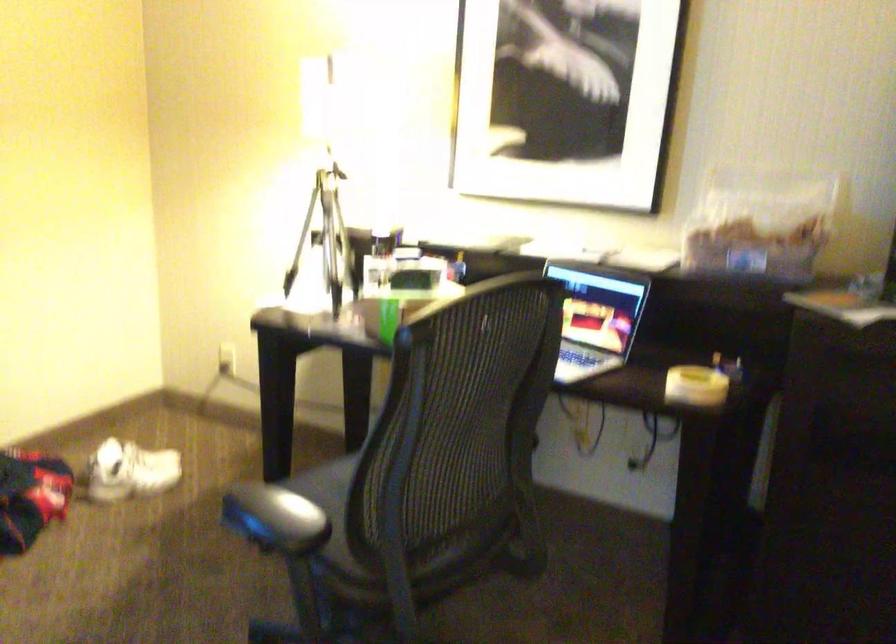
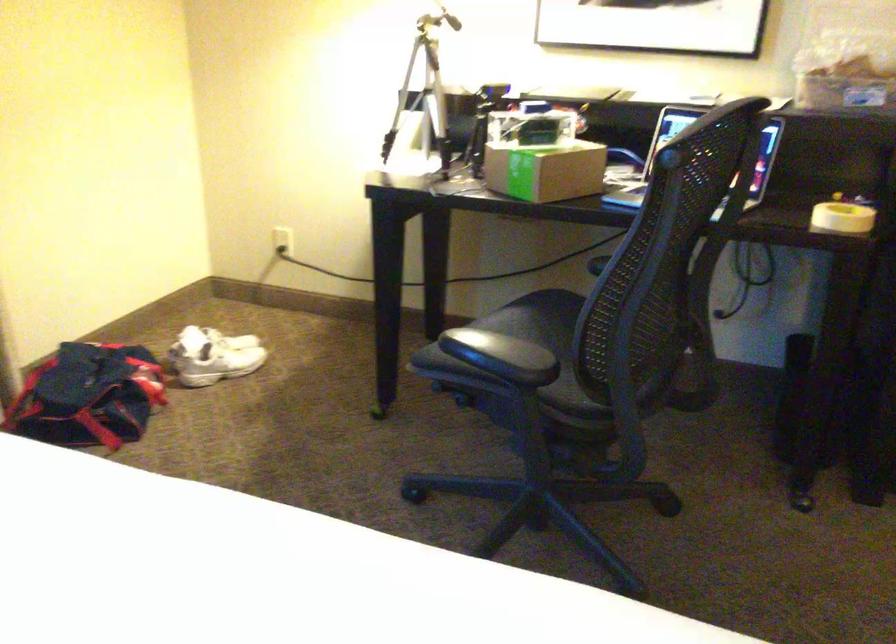
Find the pixel in the second image that matches the point at 687,391 in the first image.

(841, 216)